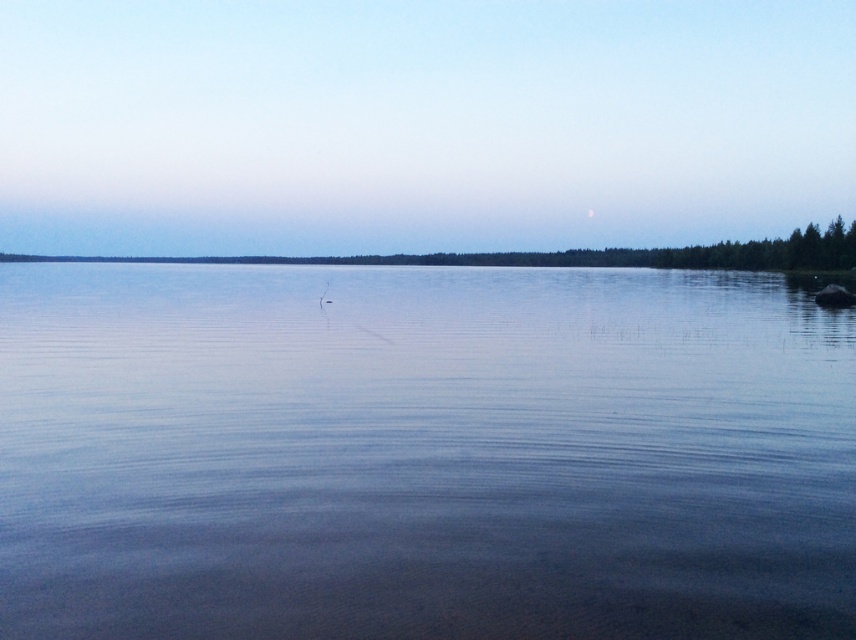
Does point (515, 445) come farther from viewer compared to point (528, 259)?

No, it is in front of (528, 259).

The width and height of the screenshot is (856, 640). I want to click on transparent water at center, so click(x=421, y=452).